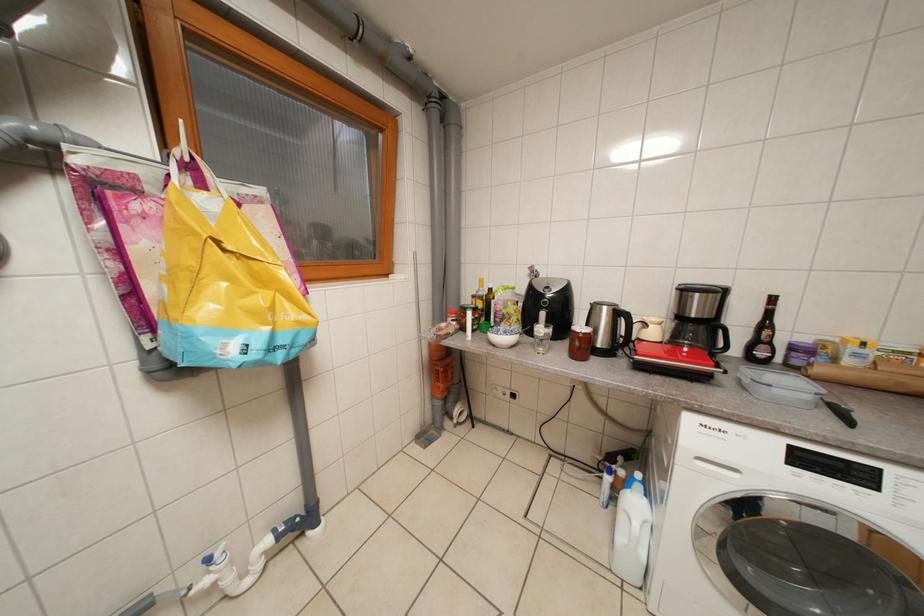
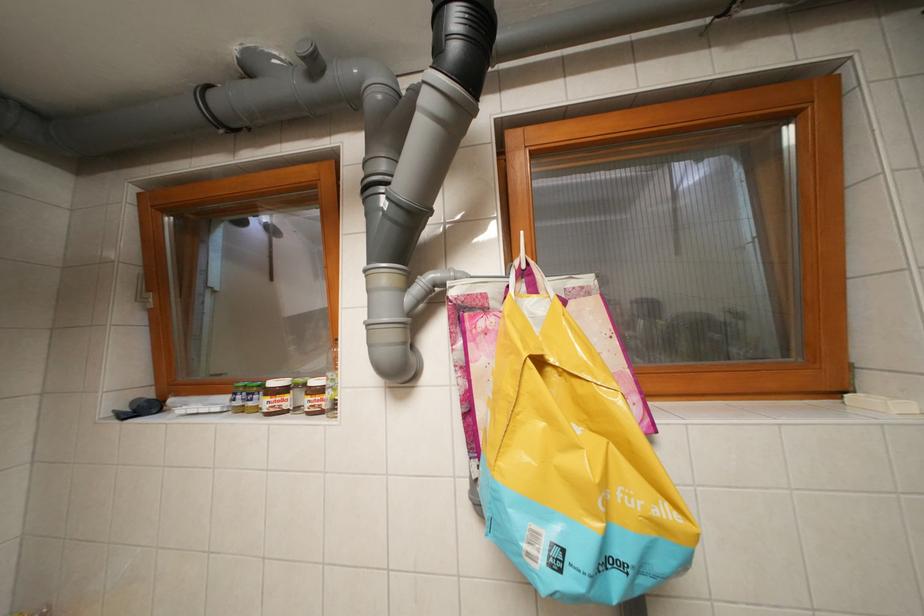
Question: Based on the continuous images, in which direction is the camera rotating? Reply with the corresponding letter.

Choices:
 (A) Left
 (B) Right
 (C) Up
 (D) Down

Answer: (A)